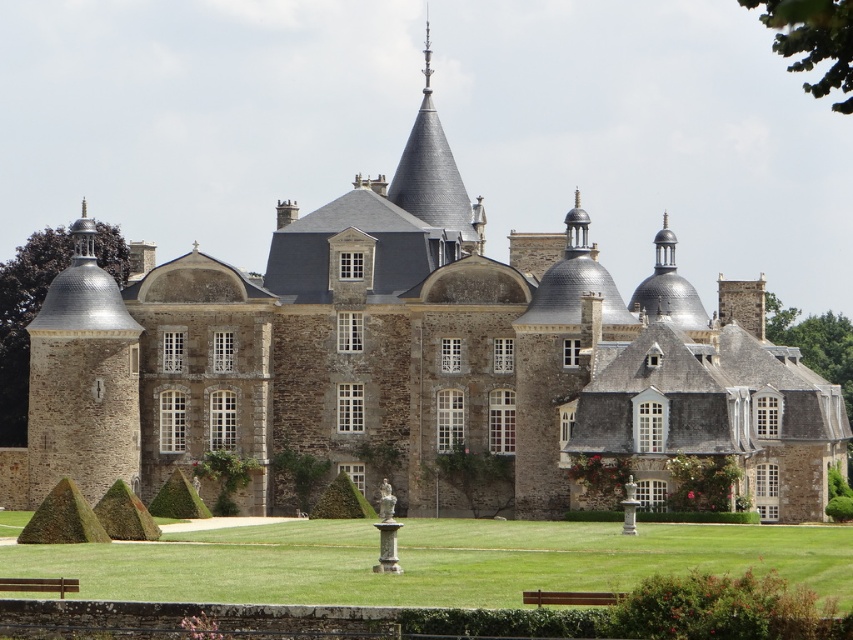
From the picture: You are standing at point [572,596] in the image of the historic building. What object is located exactly at this coordinate?

The brown wooden bench at lower center is located exactly at point [572,596].

You are a visitor to this historic castle. You want to sit down and relax while enjoying the view of the castle. Which object would be more suitable for sitting, the green grass at center or the brown wooden bench at lower left?

The brown wooden bench at lower left is more suitable for sitting because it is an object designed for seating, whereas the green grass at center is a natural surface and not intended for sitting.